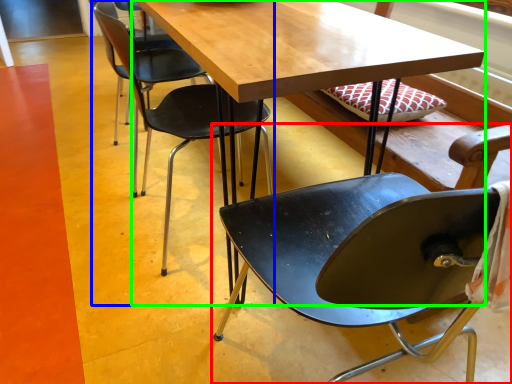
Question: Estimate the real-world distances between objects in this image. Which object is farther from chair (highlighted by a red box), chair (highlighted by a blue box) or table (highlighted by a green box)?

Choices:
 (A) chair
 (B) table

Answer: (A)